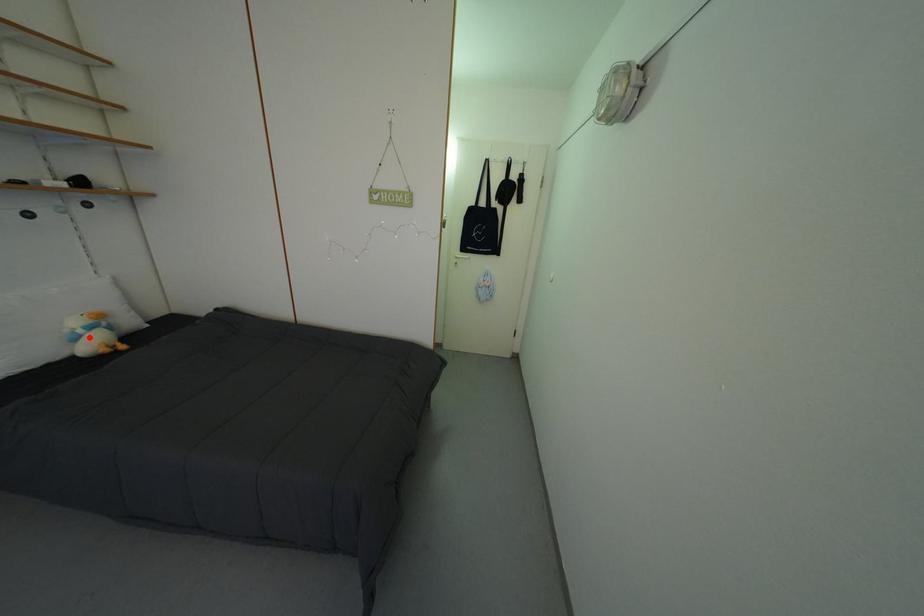
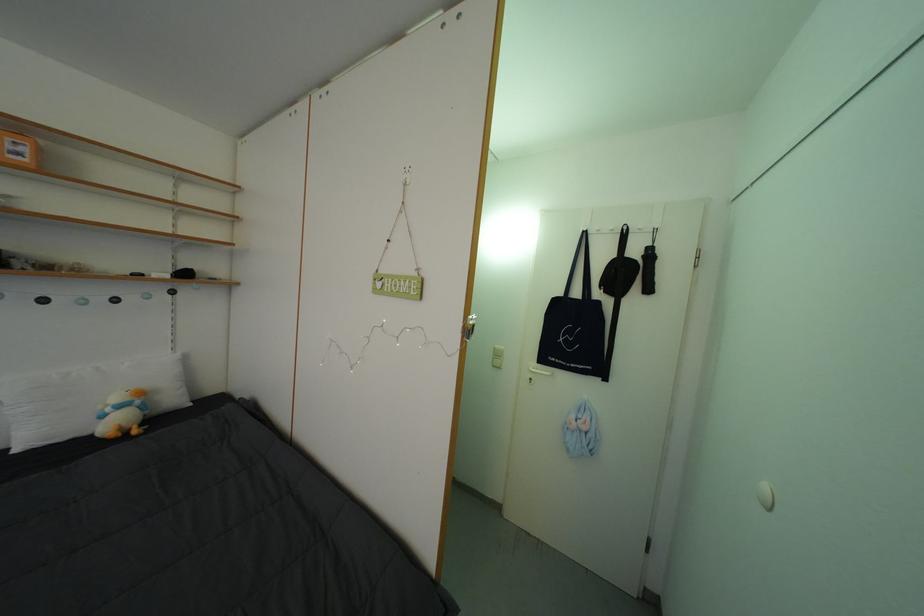
Locate, in the second image, the point that corresponds to the highlighted location in the first image.

(117, 415)